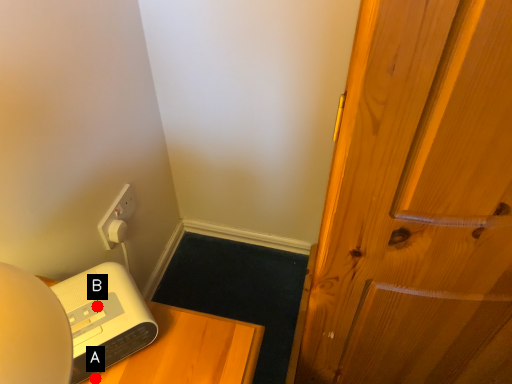
Question: Two points are circled on the image, labeled by A and B beside each circle. Among these points, which one is farthest from the camera?

Choices:
 (A) A is further
 (B) B is further

Answer: (B)